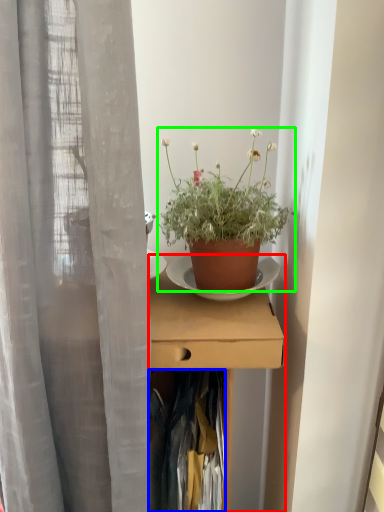
Question: Which is nearer to the desk (highlighted by a red box)? clothing (highlighted by a blue box) or houseplant (highlighted by a green box).

Choices:
 (A) clothing
 (B) houseplant

Answer: (A)